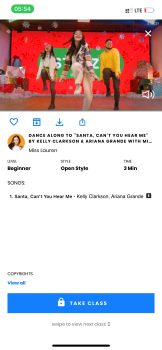
Identify the location of stack of presents. (10, 80).